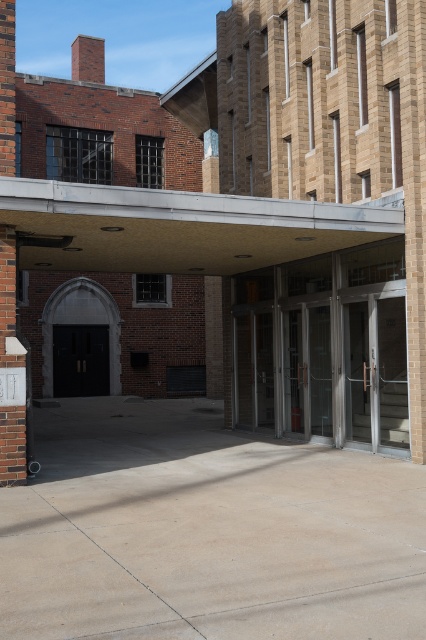
Question: Which point is closer to the camera taking this photo?

Choices:
 (A) (9, 284)
 (B) (103, 355)

Answer: (A)

Question: Is brick pillar at left positioned behind black matte door at center?

Choices:
 (A) yes
 (B) no

Answer: (B)

Question: Is brick pillar at left below black matte door at center?

Choices:
 (A) yes
 (B) no

Answer: (B)

Question: Which of the following is the closest to the observer?

Choices:
 (A) (92, 330)
 (B) (16, 282)

Answer: (B)

Question: Which point appears farthest from the camera in this image?

Choices:
 (A) (0, 435)
 (B) (94, 394)

Answer: (B)

Question: Considering the relative positions of brick pillar at left and black matte door at center in the image provided, where is brick pillar at left located with respect to black matte door at center?

Choices:
 (A) below
 (B) above

Answer: (B)